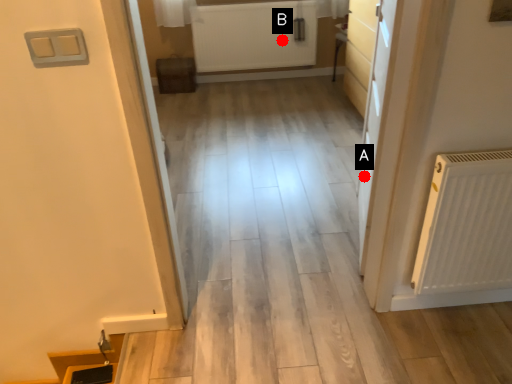
Question: Two points are circled on the image, labeled by A and B beside each circle. Which point is farther from the camera taking this photo?

Choices:
 (A) A is further
 (B) B is further

Answer: (B)